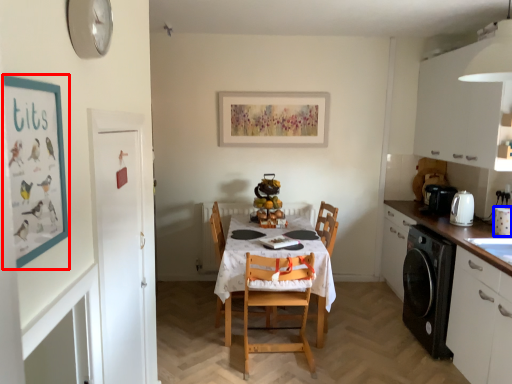
Question: Which point is closer to the camera, bulletin board (highlighted by a red box) or appliance (highlighted by a blue box)?

Choices:
 (A) bulletin board
 (B) appliance

Answer: (A)